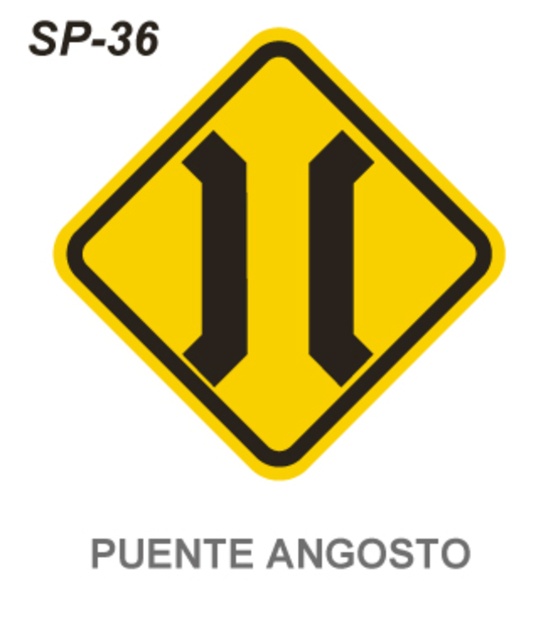
You are driving a car that is 1.5 meters wide. You see the yellow matte road sign at center indicating a narrow bridge ahead. Can your car safely pass through the bridge if the road narrows to the width shown on the sign?

The yellow matte road sign at center is 1.21 meters away from viewer. However, the sign itself does not provide specific width measurements for the bridge. Without knowing the exact width of the bridge, it is impossible to determine if your car can safely pass through.

Consider the image. You are a driver approaching a road sign. You see the yellow matte road sign at center and the black text at upper left. Which object is located to the right side of the other?

The yellow matte road sign at center is to the right of black text at upper left.